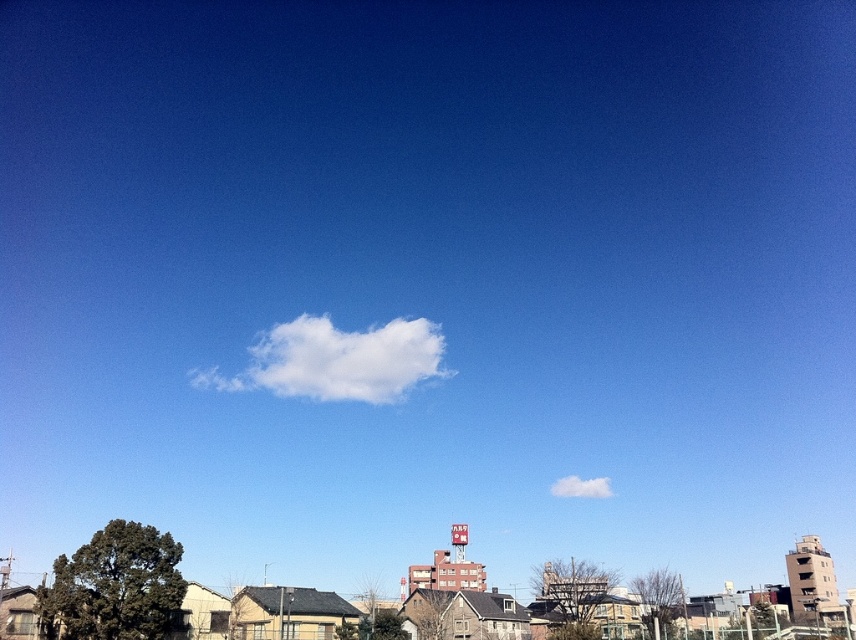
Is white fluffy cloud at center to the left of white fluffy cloud at upper center from the viewer's perspective?

Yes, white fluffy cloud at center is to the left of white fluffy cloud at upper center.

Between white fluffy cloud at center and white fluffy cloud at upper center, which one is positioned higher?

white fluffy cloud at center is above.

Does point (214, 381) lie in front of point (584, 484)?

No, it is not.

Where is `white fluffy cloud at center`? The width and height of the screenshot is (856, 640). white fluffy cloud at center is located at coordinates point(337,360).